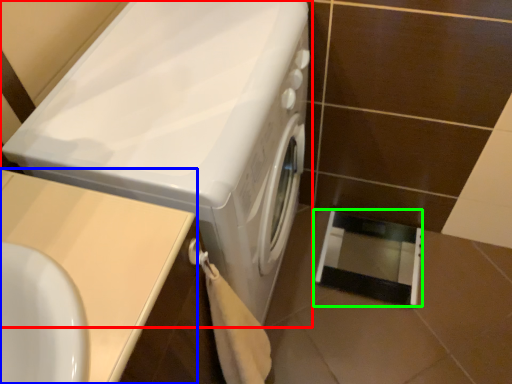
Question: Considering the real-world distances, which object is farthest from washing machine (highlighted by a red box)? counter top (highlighted by a blue box) or screen door (highlighted by a green box)?

Choices:
 (A) counter top
 (B) screen door

Answer: (B)